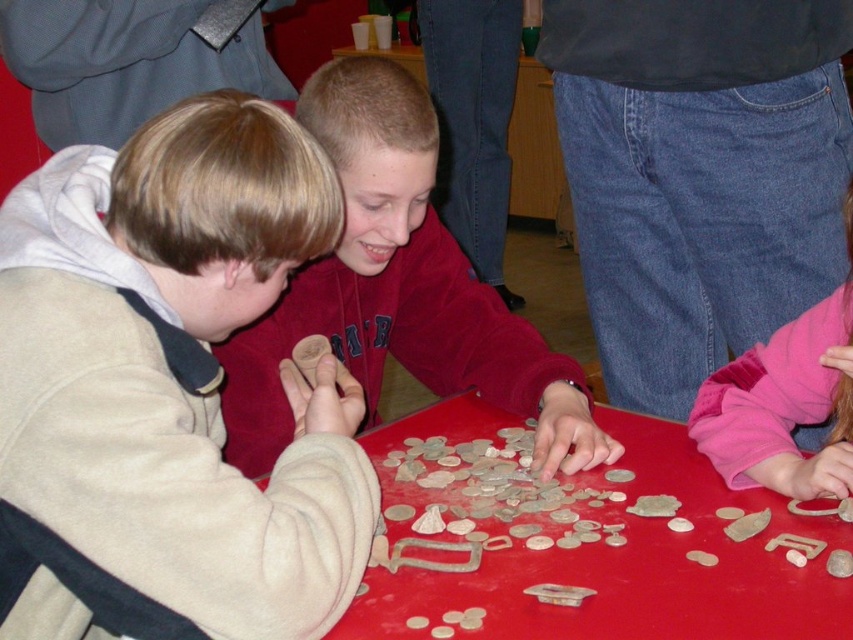
Can you confirm if beige fleece jacket at left is positioned above pink fleece sleeve at lower right?

Incorrect, beige fleece jacket at left is not positioned above pink fleece sleeve at lower right.

Does beige fleece jacket at left have a lesser height compared to pink fleece sleeve at lower right?

In fact, beige fleece jacket at left may be taller than pink fleece sleeve at lower right.

Does point (106, 502) come closer to viewer compared to point (791, 451)?

That is True.

This screenshot has height=640, width=853. Identify the location of beige fleece jacket at left. (169, 390).

Can you confirm if smooth red sweater at center is positioned to the right of pink fleece sleeve at lower right?

In fact, smooth red sweater at center is to the left of pink fleece sleeve at lower right.

Does smooth red sweater at center have a larger size compared to pink fleece sleeve at lower right?

Yes.

Who is more distant from viewer, (335, 68) or (769, 385)?

The point (769, 385) is behind.

Where is `smooth red sweater at center`? This screenshot has height=640, width=853. smooth red sweater at center is located at coordinates (398, 289).

Does smooth red sweater at center lie in front of metallic coins at center?

That is False.

Does point (276, 408) come in front of point (648, 545)?

No.

Between point (460, 310) and point (550, 556), which one is positioned behind?

The point (460, 310) is behind.

You are a GUI agent. You are given a task and a screenshot of the screen. Output one action in this format:
    pyautogui.click(x=<x>, y=<y>)
    Task: Click on the smooth red sweater at center
    The height and width of the screenshot is (640, 853).
    Given the screenshot: What is the action you would take?
    pyautogui.click(x=398, y=289)